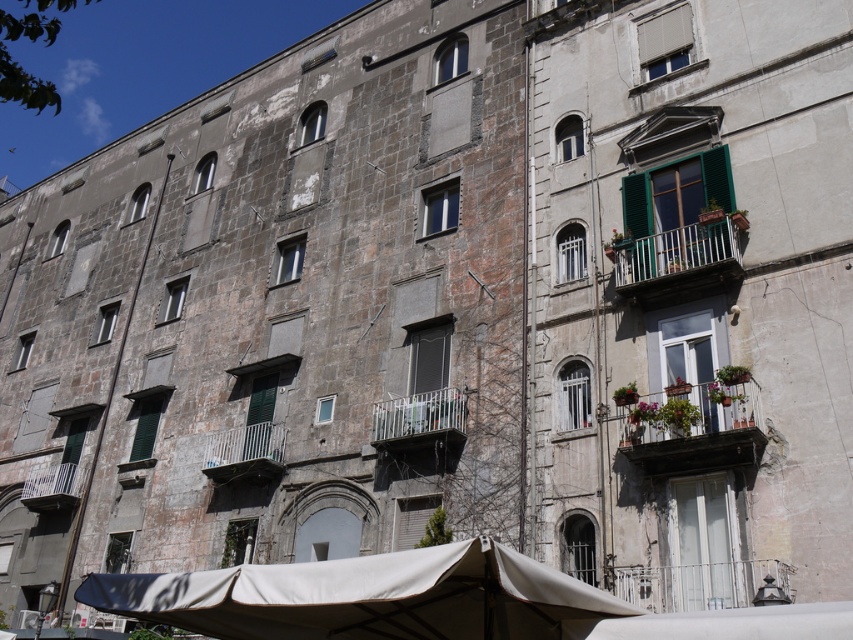
You are standing in front of the building and want to reach the white painted wood balcony at right and the white metal balcony at lower left. Which balcony should you approach first to get closer to the building?

You should approach the white painted wood balcony at right first because it is closer to the viewer than the white metal balcony at lower left.

You are standing on the ground floor looking up at the building. Which balcony, the metallic silver balcony at center or the white metal balcony at lower left, would appear higher from your vantage point?

The metallic silver balcony at center appears higher because it is much taller than the white metal balcony at lower left from your vantage point on the ground floor.

You are an architect assessing the building. You need to install a new bench on the white painted wood balcony at right and the metallic silver balcony at center. Given that the bench requires 1.5 meters of space, can both balconies accommodate the bench?

The white painted wood balcony at right is narrower than the metallic silver balcony at center. Since the bench requires 1.5 meters of space, only the metallic silver balcony at center can accommodate the bench, while the white painted wood balcony at right may be too narrow.